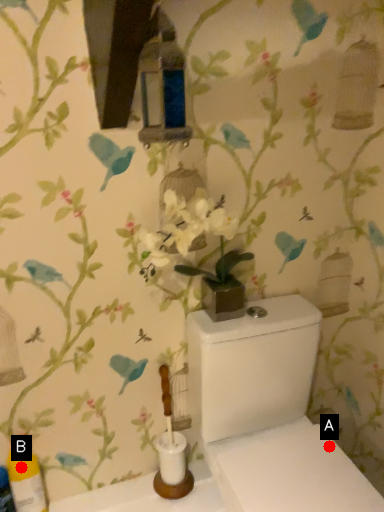
Question: Two points are circled on the image, labeled by A and B beside each circle. Which of the following is the farthest from the observer?

Choices:
 (A) A is further
 (B) B is further

Answer: (A)